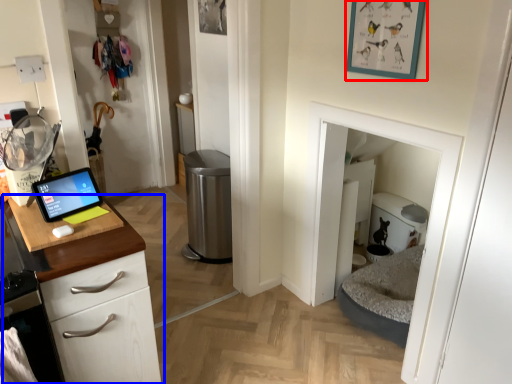
Question: Which point is further to the camera, picture frame (highlighted by a red box) or cabinetry (highlighted by a blue box)?

Choices:
 (A) picture frame
 (B) cabinetry

Answer: (A)